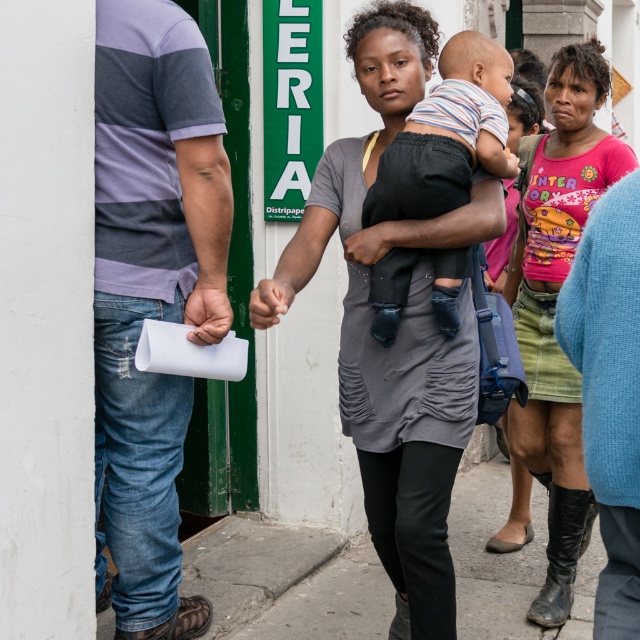
Question: Which is farther from the striped cotton shirt at left?

Choices:
 (A) striped cotton shirt at center
 (B) gray matte dress at center
 (C) matte pink shirt at center
 (D) gray concrete pavement at lower center

Answer: (D)

Question: Which point is closer to the camera?

Choices:
 (A) gray matte dress at center
 (B) striped cotton shirt at center

Answer: (A)

Question: Can you confirm if striped cotton shirt at left is positioned above striped cotton shirt at center?

Choices:
 (A) yes
 (B) no

Answer: (B)

Question: Which point is closer to the camera taking this photo?

Choices:
 (A) (428, 488)
 (B) (516, 324)

Answer: (A)

Question: Can you confirm if gray concrete pavement at lower center is wider than striped cotton shirt at center?

Choices:
 (A) yes
 (B) no

Answer: (A)

Question: Considering the relative positions of striped cotton shirt at left and gray matte dress at center in the image provided, where is striped cotton shirt at left located with respect to gray matte dress at center?

Choices:
 (A) left
 (B) right

Answer: (A)